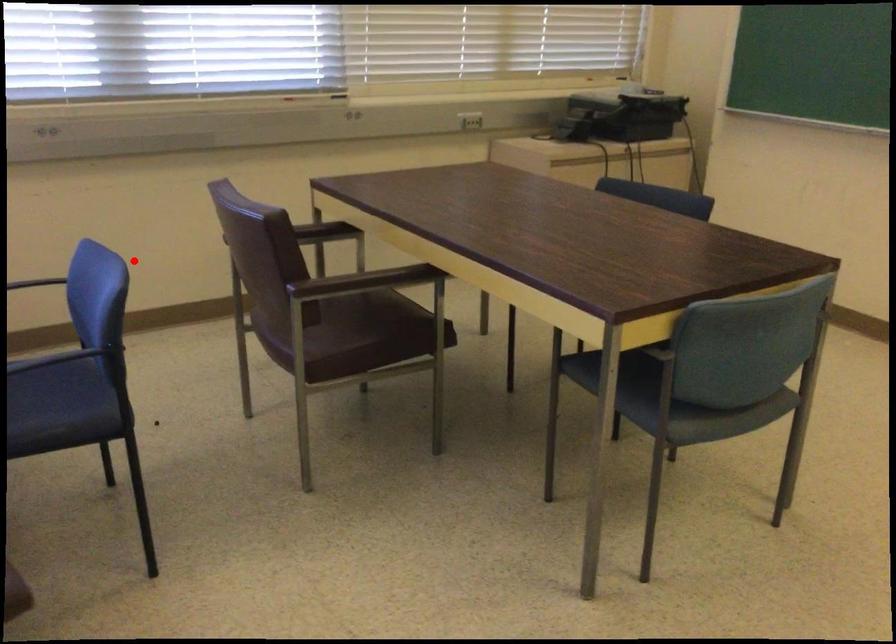
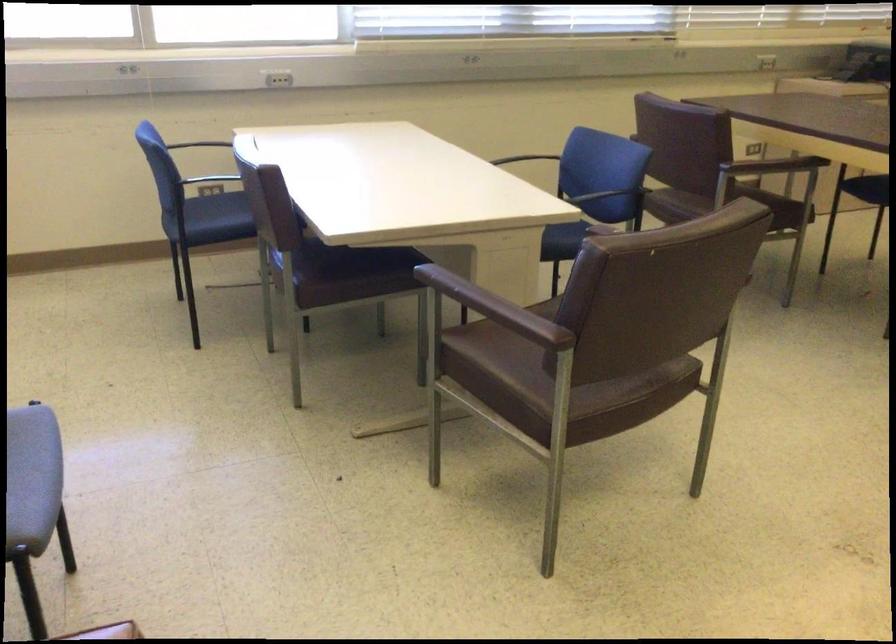
Question: I am providing you with two images of the same scene from different viewpoints. In image1, a red point is highlighted. Considering the same 3D point in image2, which of the following is correct?

Choices:
 (A) It is closer
 (B) It is farther

Answer: (B)